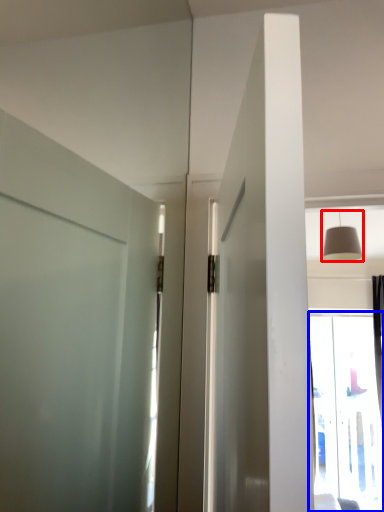
Question: Which of the following is the farthest to the observer, light fixture (highlighted by a red box) or window (highlighted by a blue box)?

Choices:
 (A) light fixture
 (B) window

Answer: (B)